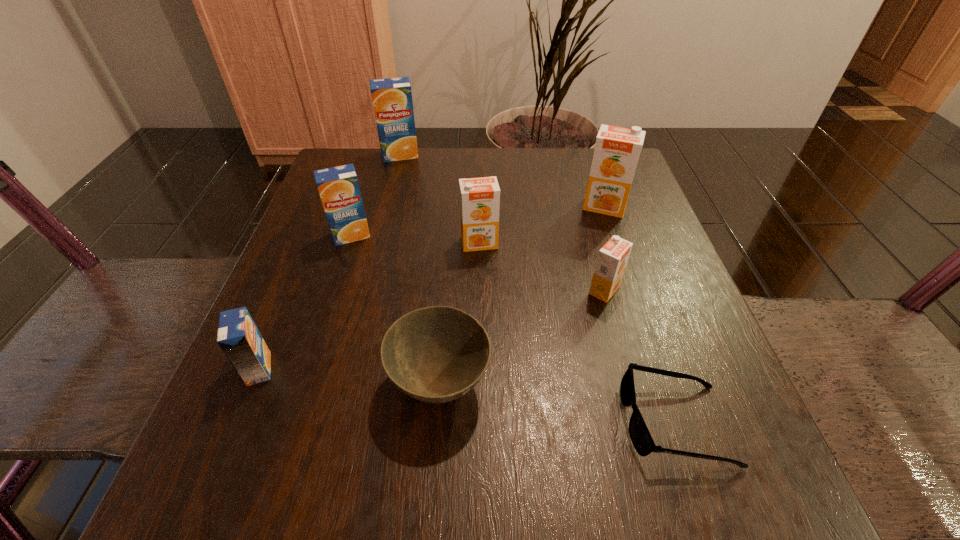
The height and width of the screenshot is (540, 960). In order to click on the fourth nearest object in this screenshot , I will do `click(612, 259)`.

I want to click on bowl, so click(436, 354).

The image size is (960, 540). Identify the location of sunglasses. (640, 436).

Locate an element on the screen. This screenshot has height=540, width=960. vacant space situated on the right of the biggest blue orange_juice is located at coordinates [x=550, y=154].

The width and height of the screenshot is (960, 540). What are the coordinates of `free space located on the back of the seventh nearest object` in the screenshot? It's located at (587, 154).

This screenshot has height=540, width=960. In order to click on vacant space located on the right of the second farthest blue orange_juice in this screenshot , I will do `click(530, 235)`.

Image resolution: width=960 pixels, height=540 pixels. Find the location of `free region located on the front of the fourth orange juice from left to right`. free region located on the front of the fourth orange juice from left to right is located at coordinates (479, 274).

The height and width of the screenshot is (540, 960). In order to click on vacant space located 0.060m on the back of the leftmost orange juice in this screenshot , I will do tap(278, 322).

Where is `free space located 0.240m on the front of the fifth farthest orange juice`? free space located 0.240m on the front of the fifth farthest orange juice is located at coordinates (644, 437).

Locate an element on the screen. vacant area situated on the right of the bowl is located at coordinates (680, 383).